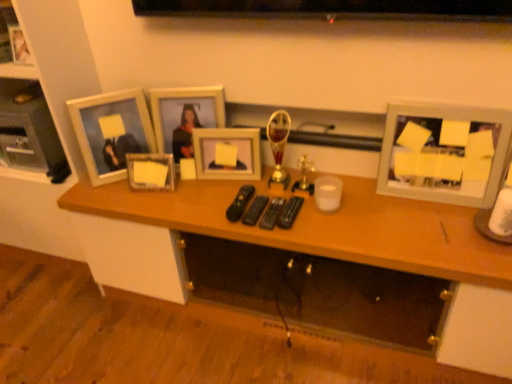
Locate an element on the screen. This screenshot has width=512, height=384. vacant space to the right of wooden picture frame at center, the 4th picture frame in the right-to-left sequence is located at coordinates (198, 191).